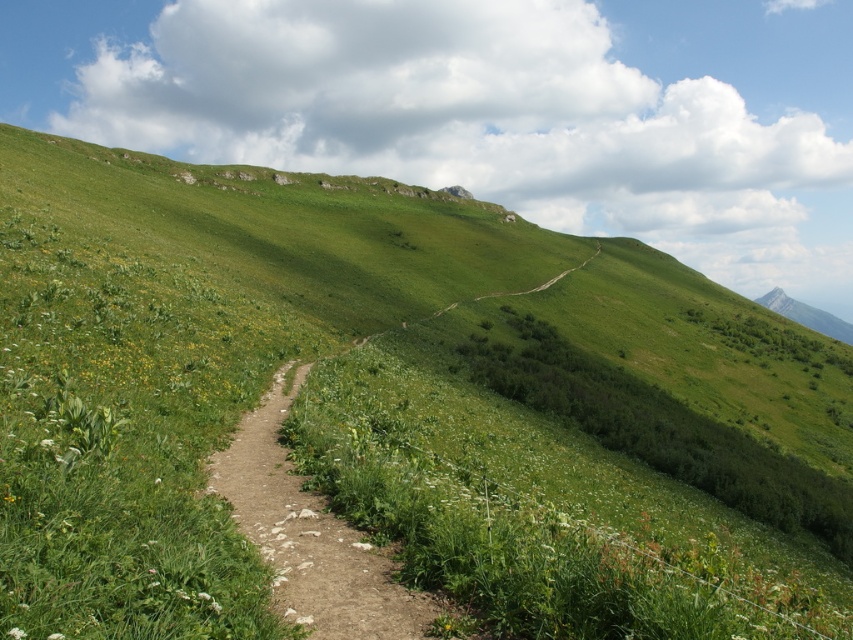
Question: Is dirt path at center in front of gray rocky mountain at upper right?

Choices:
 (A) no
 (B) yes

Answer: (B)

Question: Which point appears closest to the camera in this image?

Choices:
 (A) (775, 310)
 (B) (299, 506)

Answer: (B)

Question: Does dirt path at center have a greater width compared to gray rocky mountain at upper right?

Choices:
 (A) yes
 (B) no

Answer: (B)

Question: Which of the following is the farthest from the observer?

Choices:
 (A) (813, 310)
 (B) (279, 476)

Answer: (A)

Question: Can you confirm if dirt path at center is positioned to the left of gray rocky mountain at upper right?

Choices:
 (A) yes
 (B) no

Answer: (A)